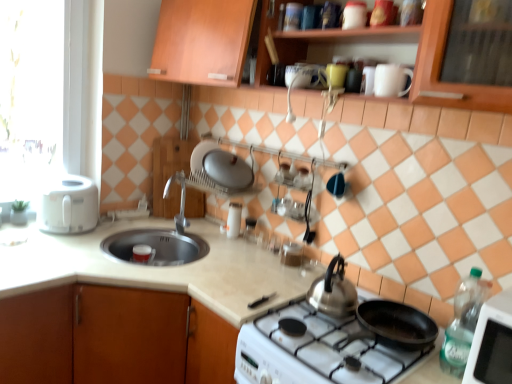
Find the location of a particular element. Image resolution: width=512 pixels, height=384 pixels. free location to the right of silver metallic faucet at center is located at coordinates (199, 237).